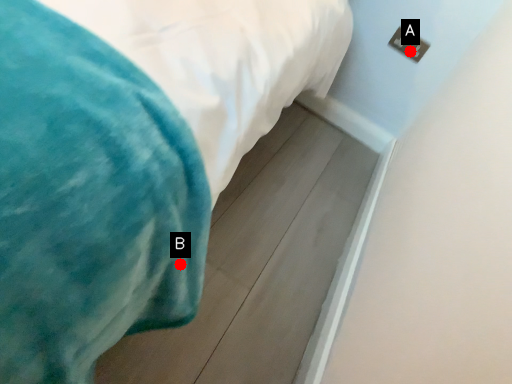
Question: Two points are circled on the image, labeled by A and B beside each circle. Among these points, which one is farthest from the camera?

Choices:
 (A) A is further
 (B) B is further

Answer: (A)